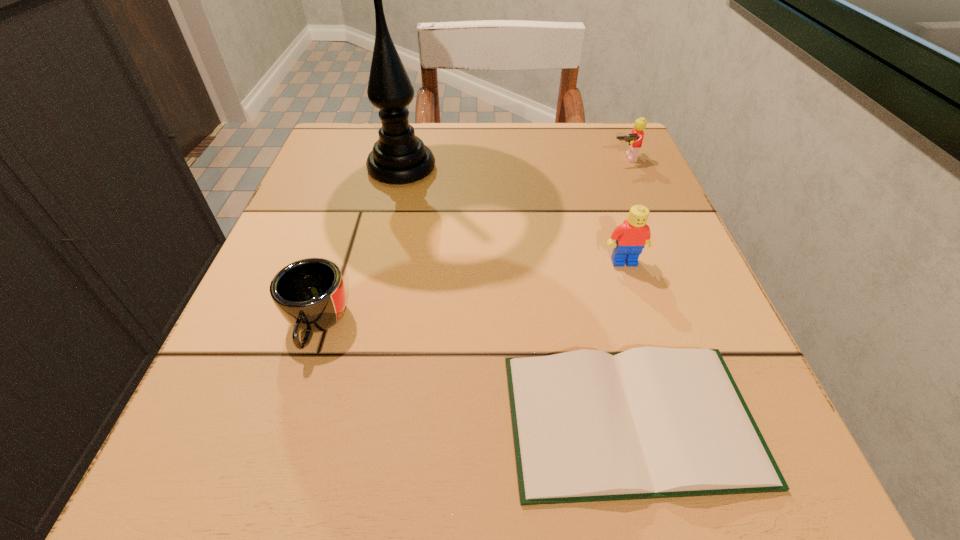
Image resolution: width=960 pixels, height=540 pixels. Find the location of `free space located 0.150m on the side of the mug with the handle`. free space located 0.150m on the side of the mug with the handle is located at coordinates (265, 485).

Locate an element on the screen. The height and width of the screenshot is (540, 960). vacant space located 0.320m on the left of the hardback book is located at coordinates (232, 419).

Locate an element on the screen. This screenshot has width=960, height=540. lamp that is at the far edge is located at coordinates (398, 157).

Identify the location of Lego positioned at the far edge. (635, 139).

I want to click on object that is at the near edge, so click(x=651, y=422).

Where is `lamp that is at the left edge`? The image size is (960, 540). lamp that is at the left edge is located at coordinates (398, 157).

What are the coordinates of `mug that is at the left edge` in the screenshot? It's located at (310, 294).

Find the location of a particular element. The image size is (960, 540). hardback book at the right edge is located at coordinates (651, 422).

The height and width of the screenshot is (540, 960). I want to click on object that is positioned at the far left corner, so click(x=398, y=157).

Image resolution: width=960 pixels, height=540 pixels. What are the coordinates of `object positioned at the far right corner` in the screenshot? It's located at (x=635, y=139).